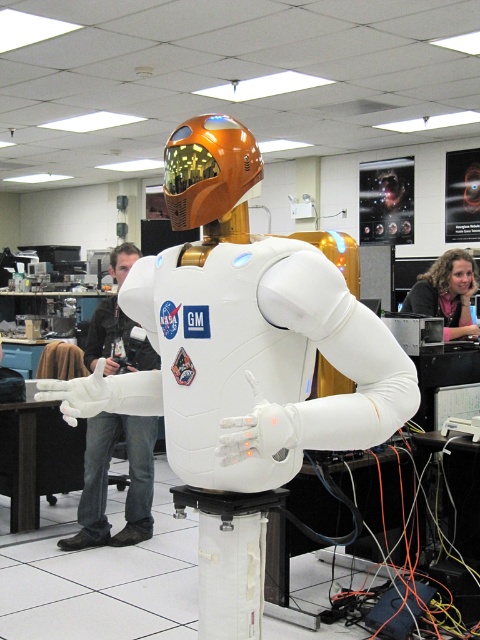
Does point (99, 349) lie in front of point (464, 321)?

Yes, it is.

Can you confirm if jeans at left is positioned below pink fabric at upper right?

Indeed, jeans at left is positioned under pink fabric at upper right.

What do you see at coordinates (107, 481) in the screenshot?
I see `jeans at left` at bounding box center [107, 481].

I want to click on jeans at left, so click(x=107, y=481).

Consider the image. Between white matte astronaut at center and pink fabric at upper right, which one is positioned lower?

white matte astronaut at center

Between point (269, 276) and point (444, 278), which one is positioned in front?

Point (269, 276)

Where is `white matte astronaut at center`? The height and width of the screenshot is (640, 480). white matte astronaut at center is located at coordinates (242, 337).

Based on the photo, is white matte astronaut at center positioned before jeans at left?

Yes.

Is white matte astronaut at center above jeans at left?

Yes.

At what (x,y) coordinates should I click in order to perform the action: click on white matte astronaut at center. Please return your answer as a coordinate pair (x, y). This screenshot has width=480, height=640. Looking at the image, I should click on (242, 337).